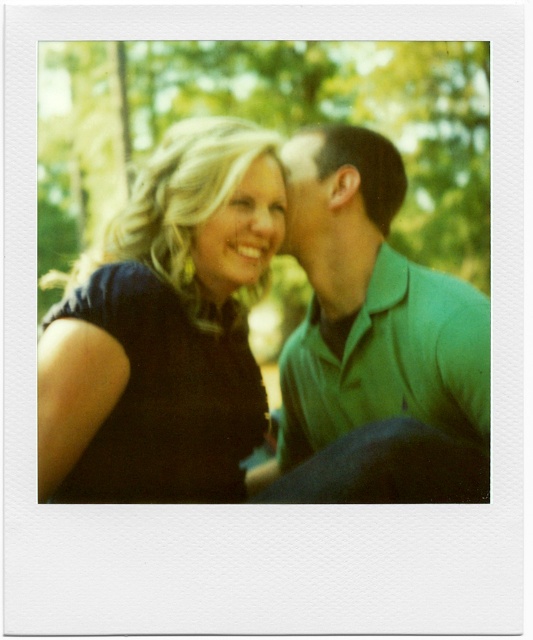
Does black matte dress at upper left lie in front of matte green forehead at upper center?

Yes.

At what (x,y) coordinates should I click in order to perform the action: click on black matte dress at upper left. Please return your answer as a coordinate pair (x, y). Looking at the image, I should click on (166, 328).

Is green smooth shirt at upper right wider than matte green forehead at upper center?

Yes.

Describe the element at coordinates (372, 314) in the screenshot. The image size is (533, 640). I see `green smooth shirt at upper right` at that location.

Identify the location of green smooth shirt at upper right. (372, 314).

Can you confirm if matte black hair at center is positioned below matte green forehead at upper center?

Correct, matte black hair at center is located below matte green forehead at upper center.

Can you confirm if matte black hair at center is positioned to the left of matte green forehead at upper center?

Yes, matte black hair at center is to the left of matte green forehead at upper center.

Where is `matte black hair at center`? matte black hair at center is located at coordinates (241, 230).